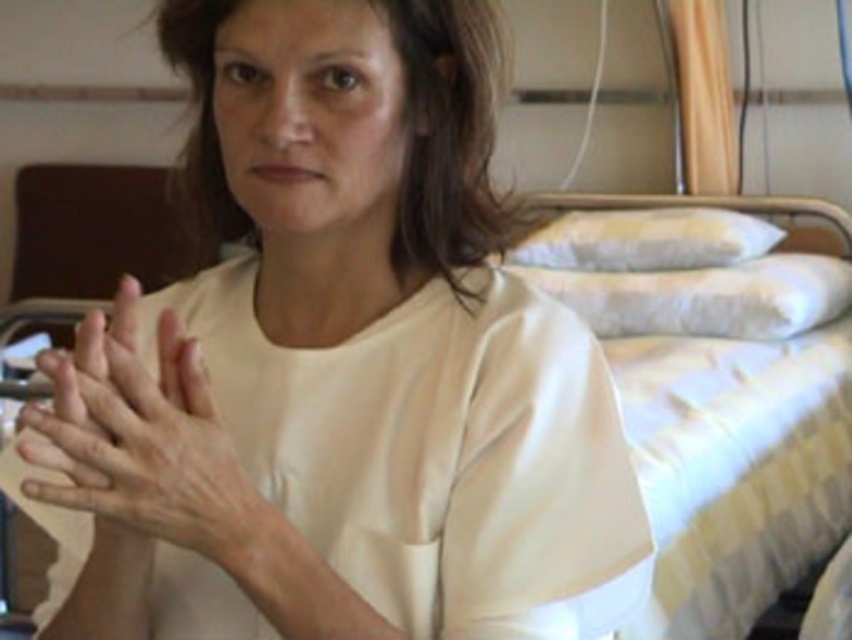
Question: Based on their relative distances, which object is nearer to the dry skin hands at center?

Choices:
 (A) white soft pillow at right
 (B) yellow striped pillow at upper right

Answer: (A)

Question: Which point appears farthest from the camera in this image?

Choices:
 (A) (787, 328)
 (B) (148, 385)

Answer: (A)

Question: Does dry skin hands at center have a smaller size compared to yellow striped pillow at upper right?

Choices:
 (A) yes
 (B) no

Answer: (A)

Question: Can you confirm if dry skin hands at center is positioned above white soft pillow at right?

Choices:
 (A) yes
 (B) no

Answer: (B)

Question: Among these objects, which one is farthest from the camera?

Choices:
 (A) white soft pillow at right
 (B) yellow striped pillow at upper right

Answer: (B)

Question: Does dry skin hands at center have a lesser width compared to white soft pillow at right?

Choices:
 (A) yes
 (B) no

Answer: (A)